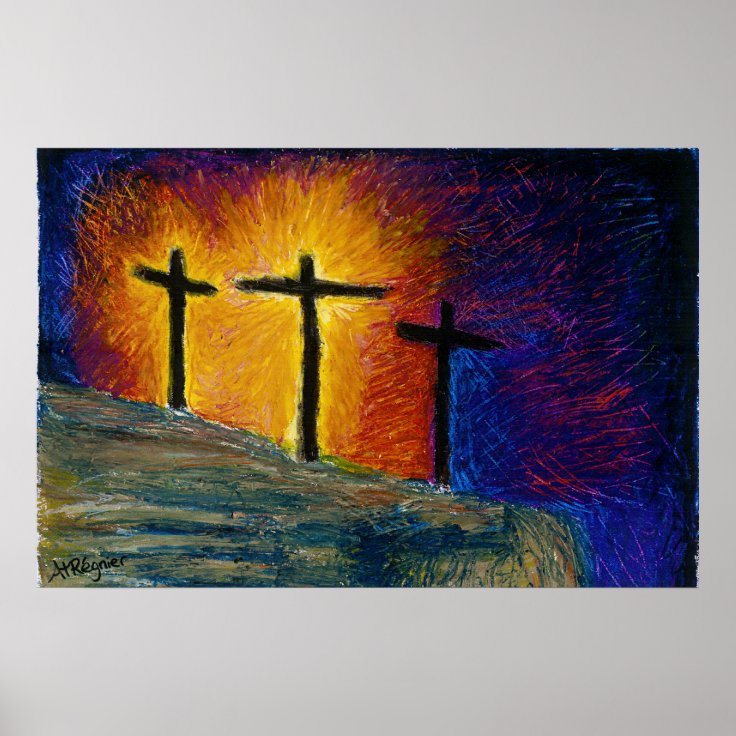
Locate an element on the screen. The height and width of the screenshot is (736, 736). wall is located at coordinates (346, 648).